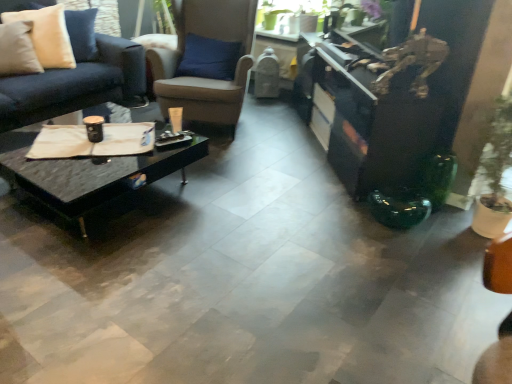
Question: Is black marble coffee table at center smaller than brown leather chair at center?

Choices:
 (A) yes
 (B) no

Answer: (A)

Question: Is black marble coffee table at center located outside brown leather chair at center?

Choices:
 (A) no
 (B) yes

Answer: (B)

Question: From a real-world perspective, is black marble coffee table at center on brown leather chair at center?

Choices:
 (A) yes
 (B) no

Answer: (B)

Question: Is black marble coffee table at center aimed at brown leather chair at center?

Choices:
 (A) yes
 (B) no

Answer: (B)

Question: Is black marble coffee table at center shorter than brown leather chair at center?

Choices:
 (A) yes
 (B) no

Answer: (A)

Question: Is brown leather chair at center at the back of black marble coffee table at center?

Choices:
 (A) yes
 (B) no

Answer: (A)

Question: Can you confirm if black glossy entertainment center at right is smaller than black marble coffee table at center?

Choices:
 (A) yes
 (B) no

Answer: (B)

Question: Does black glossy entertainment center at right have a greater height compared to black marble coffee table at center?

Choices:
 (A) yes
 (B) no

Answer: (A)

Question: Can you confirm if black glossy entertainment center at right is positioned to the left of black marble coffee table at center?

Choices:
 (A) no
 (B) yes

Answer: (A)

Question: Is black glossy entertainment center at right not close to black marble coffee table at center?

Choices:
 (A) no
 (B) yes

Answer: (B)

Question: Can we say black glossy entertainment center at right lies outside black marble coffee table at center?

Choices:
 (A) no
 (B) yes

Answer: (B)

Question: Is black glossy entertainment center at right touching black marble coffee table at center?

Choices:
 (A) no
 (B) yes

Answer: (A)

Question: Does beige fabric pillow at upper left have a lesser width compared to black glossy entertainment center at right?

Choices:
 (A) no
 (B) yes

Answer: (B)